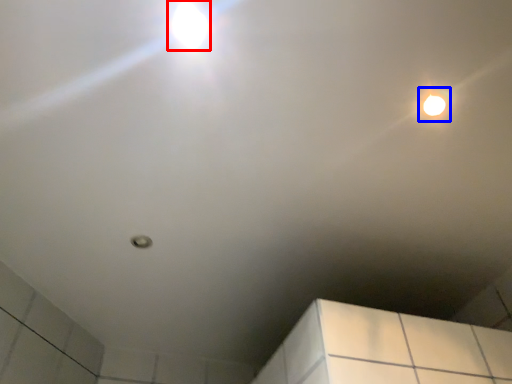
Question: Which point is further to the camera, droplight (highlighted by a red box) or droplight (highlighted by a blue box)?

Choices:
 (A) droplight
 (B) droplight

Answer: (B)